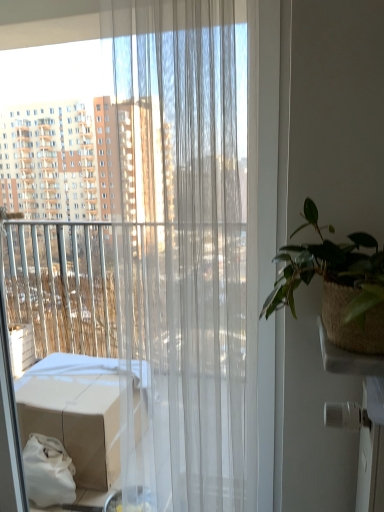
Question: Is green woven pot at right turned away from translucent white curtain at center?

Choices:
 (A) yes
 (B) no

Answer: (B)

Question: From a real-world perspective, does green woven pot at right stand above translucent white curtain at center?

Choices:
 (A) yes
 (B) no

Answer: (A)

Question: Is green woven pot at right not near translucent white curtain at center?

Choices:
 (A) yes
 (B) no

Answer: (B)

Question: Can you confirm if green woven pot at right is positioned to the left of translucent white curtain at center?

Choices:
 (A) no
 (B) yes

Answer: (A)

Question: Is green woven pot at right to the right of translucent white curtain at center from the viewer's perspective?

Choices:
 (A) no
 (B) yes

Answer: (B)

Question: Considering the relative sizes of green woven pot at right and translucent white curtain at center in the image provided, is green woven pot at right shorter than translucent white curtain at center?

Choices:
 (A) no
 (B) yes

Answer: (B)

Question: Is translucent white curtain at center facing towards green woven pot at right?

Choices:
 (A) yes
 (B) no

Answer: (B)

Question: Is translucent white curtain at center not inside green woven pot at right?

Choices:
 (A) no
 (B) yes

Answer: (B)

Question: Is translucent white curtain at center surrounding green woven pot at right?

Choices:
 (A) yes
 (B) no

Answer: (B)

Question: Can you confirm if translucent white curtain at center is shorter than green woven pot at right?

Choices:
 (A) no
 (B) yes

Answer: (A)

Question: From a real-world perspective, is translucent white curtain at center positioned under green woven pot at right based on gravity?

Choices:
 (A) yes
 (B) no

Answer: (A)

Question: From a real-world perspective, is translucent white curtain at center on top of green woven pot at right?

Choices:
 (A) no
 (B) yes

Answer: (A)

Question: Looking at the image, does translucent white curtain at center seem bigger or smaller compared to green woven pot at right?

Choices:
 (A) big
 (B) small

Answer: (A)